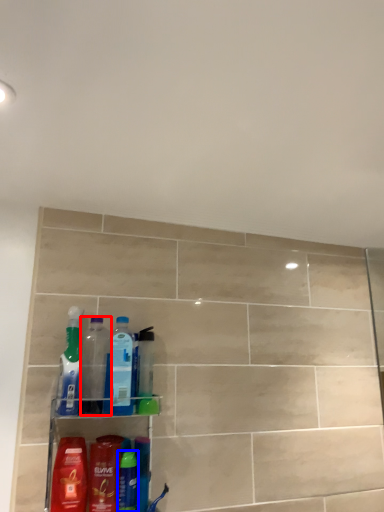
Question: Which object is further to the camera taking this photo, bottle (highlighted by a red box) or toiletry (highlighted by a blue box)?

Choices:
 (A) bottle
 (B) toiletry

Answer: (A)